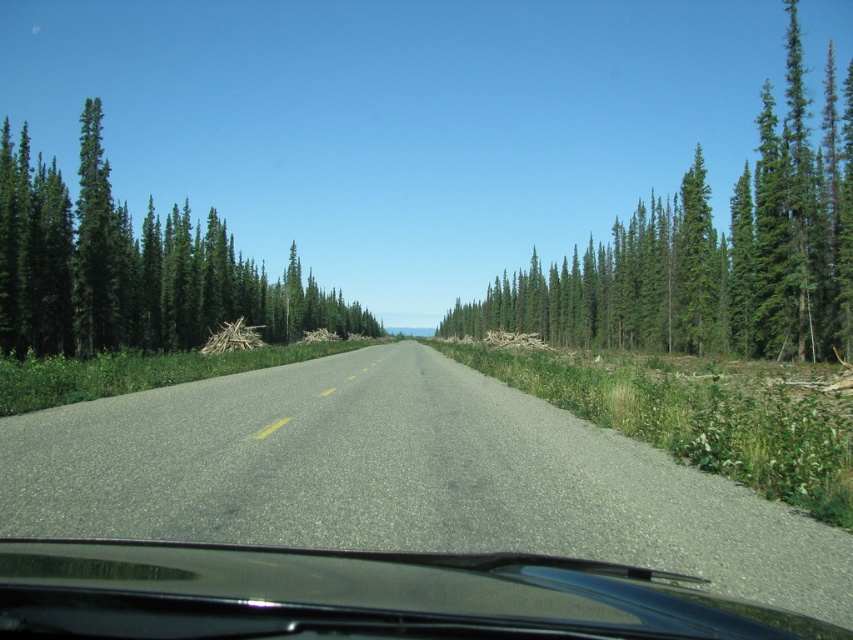
Question: Among these points, which one is nearest to the camera?

Choices:
 (A) (244, 307)
 (B) (460, 444)

Answer: (B)

Question: Estimate the real-world distances between objects in this image. Which object is farther from the asphalt road at center?

Choices:
 (A) green coniferous trees at left
 (B) black glossy windshield wiper at center

Answer: (A)

Question: Observing the image, what is the correct spatial positioning of black glossy windshield wiper at center in reference to green coniferous trees at right?

Choices:
 (A) below
 (B) above

Answer: (A)

Question: Does black glossy windshield wiper at center appear over green coniferous trees at left?

Choices:
 (A) no
 (B) yes

Answer: (A)

Question: Which of the following is the closest to the observer?

Choices:
 (A) green coniferous trees at left
 (B) asphalt road at center
 (C) green coniferous trees at right
 (D) black glossy windshield wiper at center

Answer: (D)

Question: Can you confirm if asphalt road at center is positioned below black glossy windshield wiper at center?

Choices:
 (A) yes
 (B) no

Answer: (A)